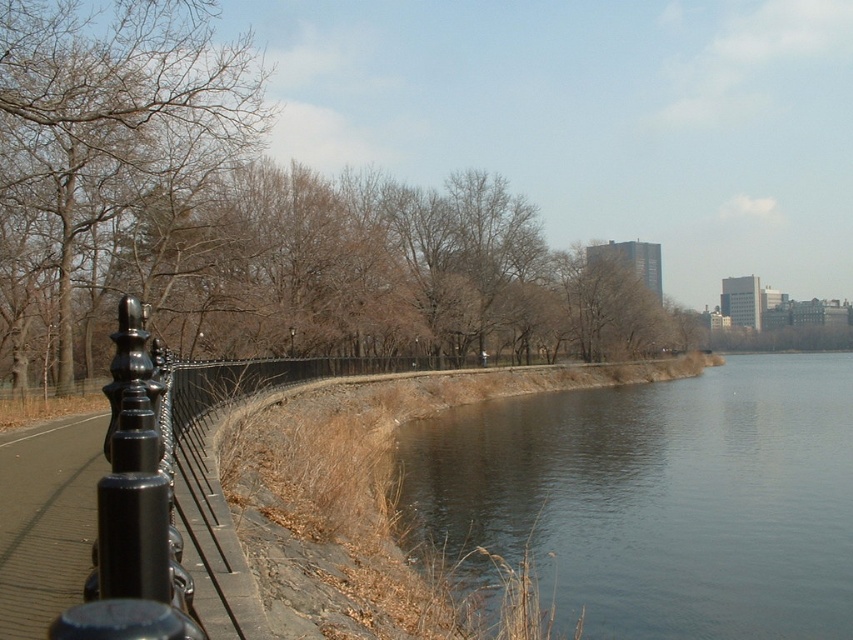
Which of these two, dark gray water at lower right or black metal fence at left, stands shorter?

black metal fence at left

Is dark gray water at lower right to the right of black metal fence at left from the viewer's perspective?

Indeed, dark gray water at lower right is positioned on the right side of black metal fence at left.

Is point (732, 362) behind point (65, 602)?

Yes, it is.

Where is `dark gray water at lower right`? Image resolution: width=853 pixels, height=640 pixels. dark gray water at lower right is located at coordinates (659, 499).

Looking at this image, measure the distance between point (202, 72) and camera.

A distance of 23.28 meters exists between point (202, 72) and camera.

The width and height of the screenshot is (853, 640). I want to click on brown leafy tree at left, so click(244, 218).

Who is more forward, [572,273] or [83,36]?

Point [83,36] is in front.

Where is `brown leafy tree at left`? The width and height of the screenshot is (853, 640). brown leafy tree at left is located at coordinates (244, 218).